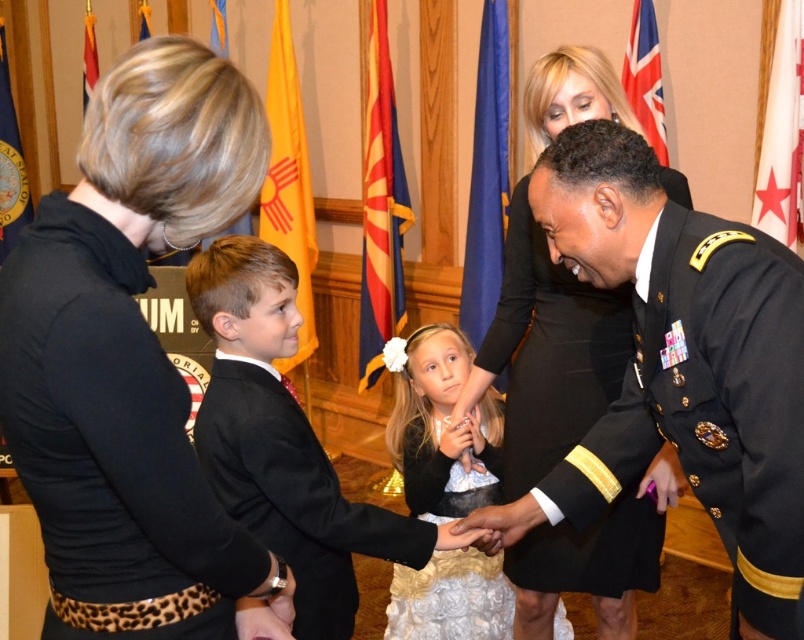
Question: In this image, where is black dress at center located relative to black satin suit at center?

Choices:
 (A) below
 (B) above

Answer: (B)

Question: Which point is farther to the camera?

Choices:
 (A) (240, 380)
 (B) (429, 440)
 (C) (531, 632)

Answer: (B)

Question: In this image, where is black satin suit at left located relative to black satin suit at center?

Choices:
 (A) left
 (B) right

Answer: (A)

Question: Which of the following is the farthest from the observer?

Choices:
 (A) black satin suit at left
 (B) white satin dress at center
 (C) black satin suit at center
 (D) black dress at center

Answer: (B)

Question: In this image, where is black dress at center located relative to black satin suit at center?

Choices:
 (A) below
 (B) above

Answer: (B)

Question: Which object is positioned farthest from the black satin suit at left?

Choices:
 (A) white satin dress at center
 (B) black satin suit at center

Answer: (A)